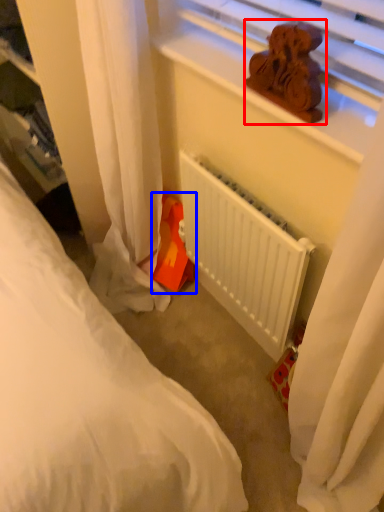
Question: Which point is further to the camera, miniature (highlighted by a red box) or stuff (highlighted by a blue box)?

Choices:
 (A) miniature
 (B) stuff

Answer: (B)